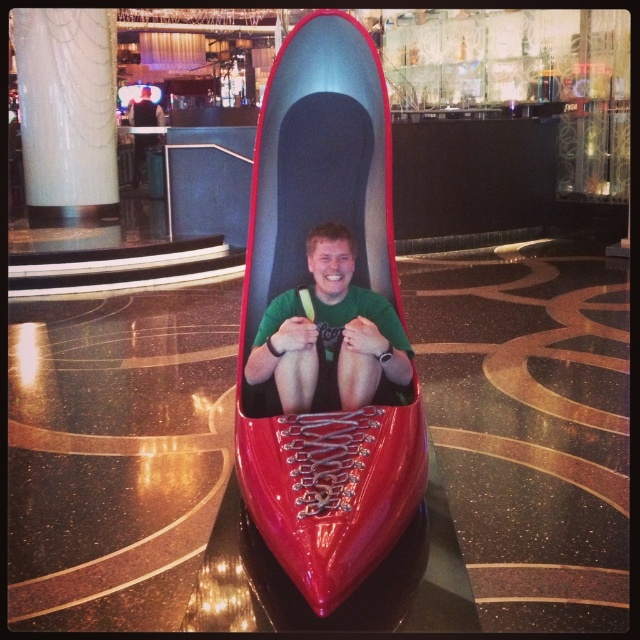
Can you confirm if green matte shirt at center is wider than green fabric shirt at center?

No.

What do you see at coordinates (330, 333) in the screenshot? I see `green matte shirt at center` at bounding box center [330, 333].

This screenshot has height=640, width=640. What are the coordinates of `green matte shirt at center` in the screenshot? It's located at (330, 333).

Who is shorter, glossy plastic shoe at center or green matte shirt at center?

With less height is green matte shirt at center.

Can you confirm if glossy plastic shoe at center is smaller than green matte shirt at center?

No.

Measure the distance between point (268, 92) and camera.

They are 3.15 meters apart.

Find the location of a particular element. The image size is (640, 640). glossy plastic shoe at center is located at coordinates click(x=308, y=285).

Is the position of glossy plastic shoe at center less distant than that of green fabric shirt at center?

That is True.

Who is positioned more to the right, glossy plastic shoe at center or green fabric shirt at center?

glossy plastic shoe at center

Is point (380, 170) less distant than point (132, 144)?

Yes, it is in front of point (132, 144).

In order to click on glossy plastic shoe at center in this screenshot , I will do `click(308, 285)`.